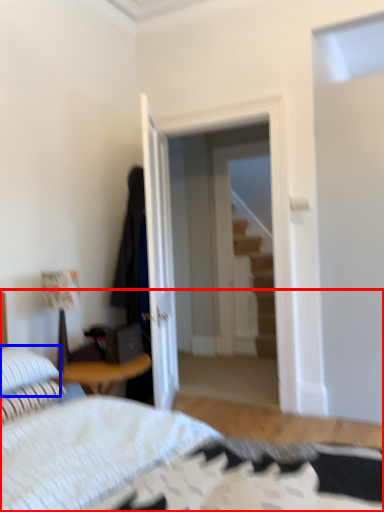
Question: Which object is closer to the camera taking this photo, bed (highlighted by a red box) or pillow (highlighted by a blue box)?

Choices:
 (A) bed
 (B) pillow

Answer: (A)